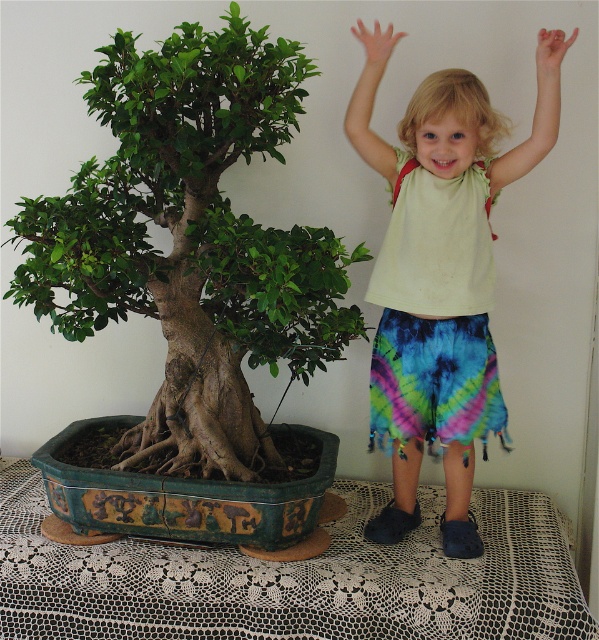
Who is shorter, green leafy bonsai at left or light yellow cotton shirt at upper center?

With less height is green leafy bonsai at left.

Who is more distant from viewer, (253,452) or (428,211)?

Point (253,452)

This screenshot has height=640, width=599. I want to click on green leafy bonsai at left, so click(190, 241).